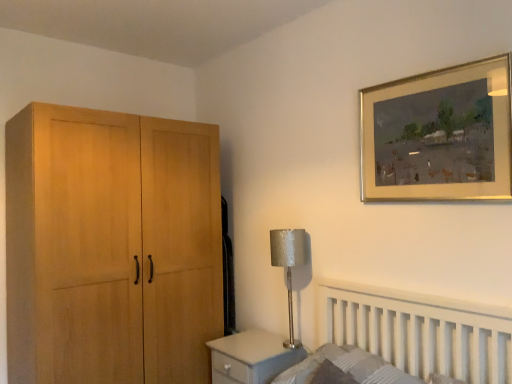
Question: From the image's perspective, is gold-framed painting at upper right positioned above or below textured gray mattress at lower right?

Choices:
 (A) above
 (B) below

Answer: (A)

Question: From a real-world perspective, is gold-framed painting at upper right above or below textured gray mattress at lower right?

Choices:
 (A) above
 (B) below

Answer: (A)

Question: Based on their relative distances, which object is farther from the gold-framed painting at upper right?

Choices:
 (A) silver textured lampshade at center-right
 (B) textured gray mattress at lower right
 (C) matte gray changing table at lower center

Answer: (C)

Question: Estimate the real-world distances between objects in this image. Which object is closer to the gold-framed painting at upper right?

Choices:
 (A) silver textured lampshade at center-right
 (B) matte gray changing table at lower center
 (C) textured gray mattress at lower right

Answer: (A)